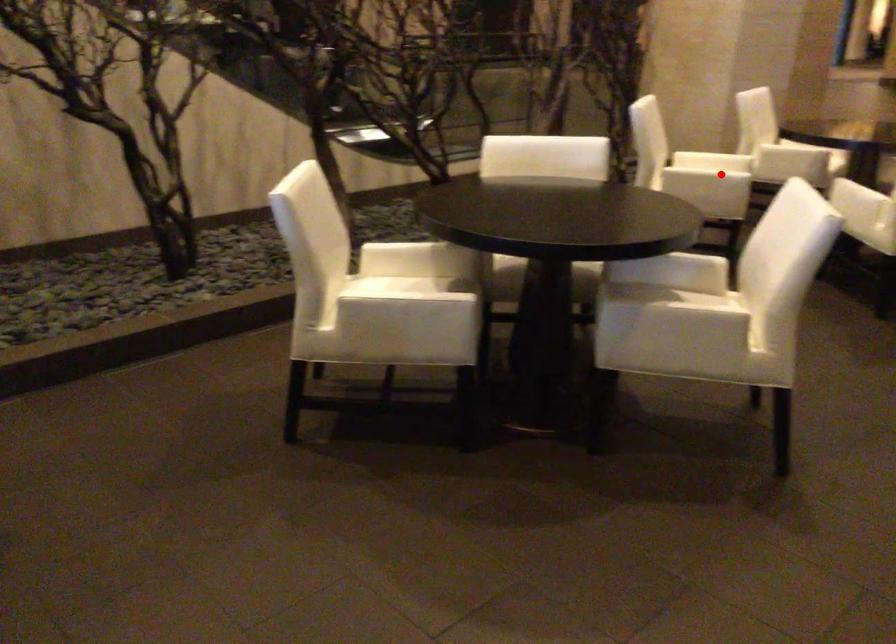
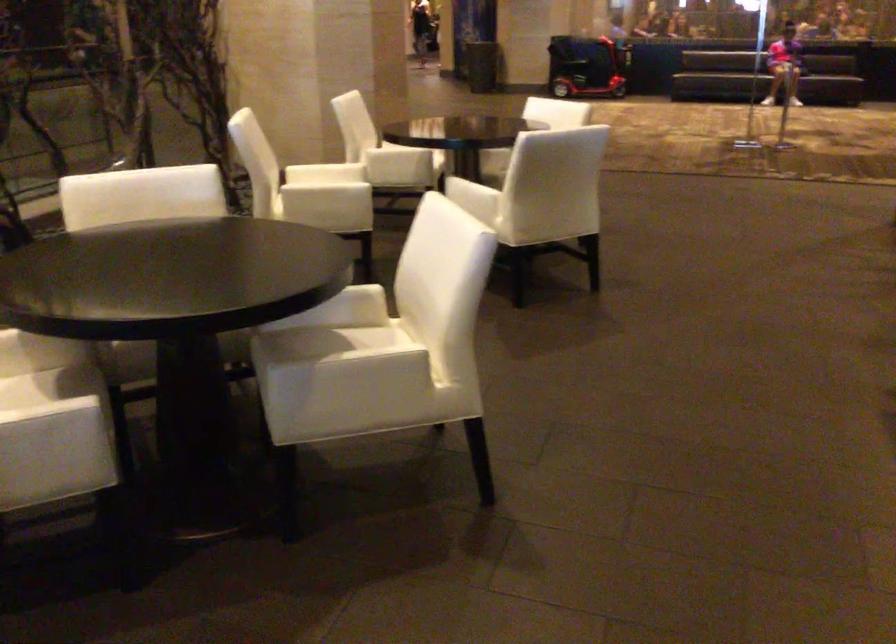
In the second image, find the point that corresponds to the highlighted location in the first image.

(325, 199)